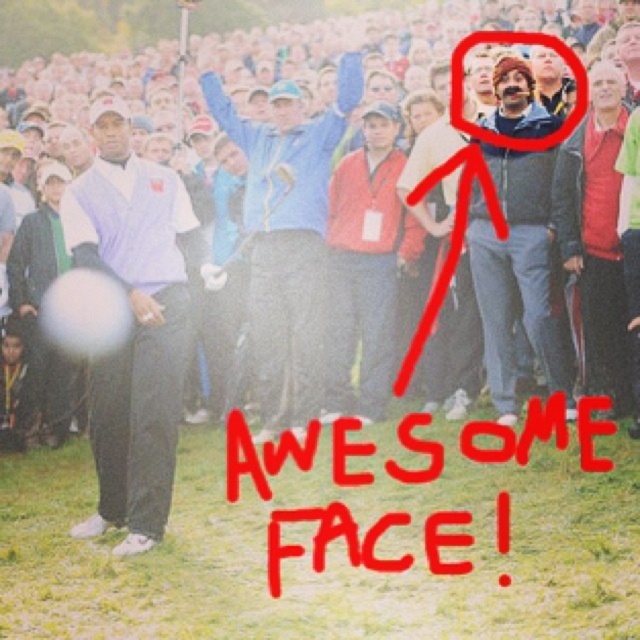
Question: Which object appears closest to the camera in this image?

Choices:
 (A) matte purple vest at left
 (B) blue fabric jacket at center

Answer: (A)

Question: Which object appears farthest from the camera in this image?

Choices:
 (A) blue denim jacket at upper center
 (B) blue fabric jacket at center
 (C) matte purple vest at left
 (D) gray fleece jacket at upper right

Answer: (B)

Question: In this image, where is white shirt at upper center located relative to blue denim jacket at upper center?

Choices:
 (A) left
 (B) right

Answer: (A)

Question: Does matte purple vest at left have a greater width compared to blue denim jacket at upper center?

Choices:
 (A) no
 (B) yes

Answer: (B)

Question: Does blue fabric jacket at center have a lesser width compared to gray fleece jacket at upper right?

Choices:
 (A) no
 (B) yes

Answer: (A)

Question: Which point is closer to the camera?

Choices:
 (A) (490, 330)
 (B) (160, 208)
 (C) (76, 90)
 (D) (259, 220)

Answer: (B)